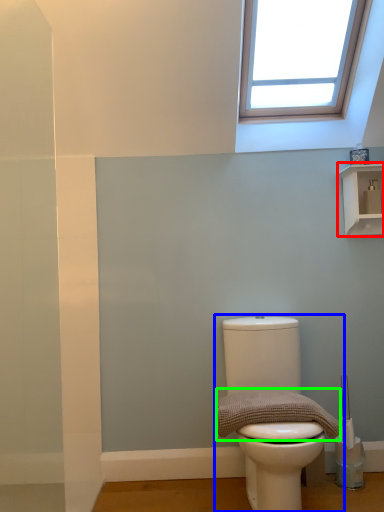
Question: Which is nearer to the shelf (highlighted by a red box)? toilet (highlighted by a blue box) or material (highlighted by a green box).

Choices:
 (A) toilet
 (B) material

Answer: (B)